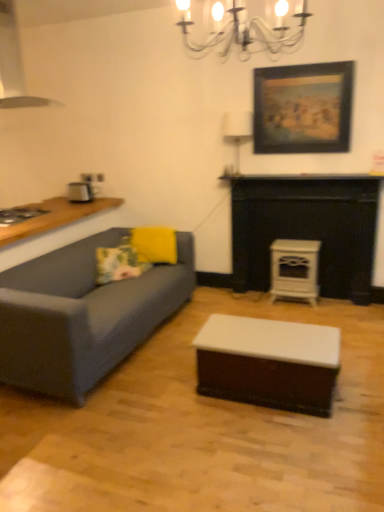
Where is `free space below wooden framed painting at upper right (from a real-world perspective)`? The height and width of the screenshot is (512, 384). free space below wooden framed painting at upper right (from a real-world perspective) is located at coordinates (302, 169).